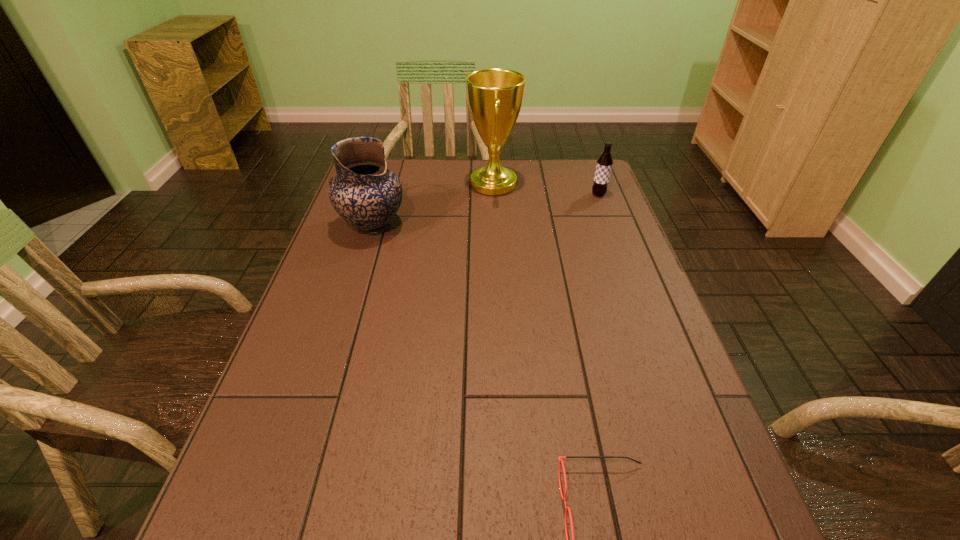
Where is `award`? This screenshot has height=540, width=960. award is located at coordinates (495, 96).

Image resolution: width=960 pixels, height=540 pixels. I want to click on the second object from left to right, so click(x=495, y=96).

Identify the location of pottery. The image size is (960, 540). (365, 193).

In order to click on the third shortest object in this screenshot , I will do `click(365, 193)`.

The width and height of the screenshot is (960, 540). I want to click on the third tallest object, so 604,164.

The width and height of the screenshot is (960, 540). Identify the location of root beer. (604, 164).

Where is `vacant position located 0.240m by the handles of the tallest object`? Image resolution: width=960 pixels, height=540 pixels. vacant position located 0.240m by the handles of the tallest object is located at coordinates (396, 184).

You are a GUI agent. You are given a task and a screenshot of the screen. Output one action in this format:
    pyautogui.click(x=<x>, y=<y>)
    Task: Click on the vacant position located 0.100m by the handles of the tallest object
    This screenshot has width=960, height=540.
    Given the screenshot: What is the action you would take?
    pyautogui.click(x=438, y=184)

Where is `vacant space located 0.050m by the handles of the tallest object`? This screenshot has height=540, width=960. vacant space located 0.050m by the handles of the tallest object is located at coordinates (453, 184).

Where is `vacant position located 0.130m on the right of the pottery`? The height and width of the screenshot is (540, 960). vacant position located 0.130m on the right of the pottery is located at coordinates (452, 226).